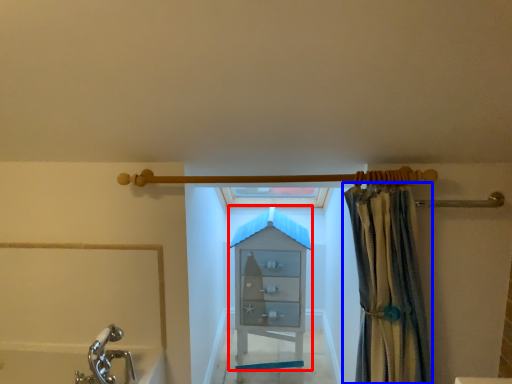
Question: Which object appears farthest to the camera in this image, cabinet (highlighted by a red box) or curtain (highlighted by a blue box)?

Choices:
 (A) cabinet
 (B) curtain

Answer: (A)